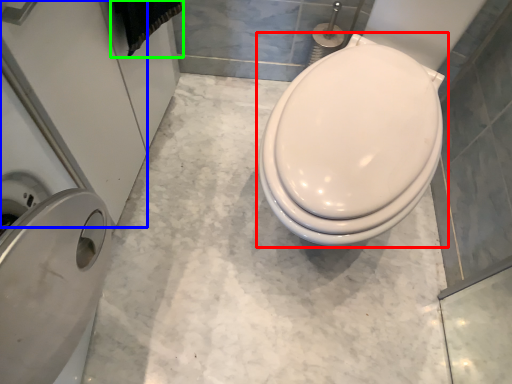
Question: Estimate the real-world distances between objects in this image. Which object is farther from toilet (highlighted by a red box), screen door (highlighted by a blue box) or material (highlighted by a green box)?

Choices:
 (A) screen door
 (B) material

Answer: (A)